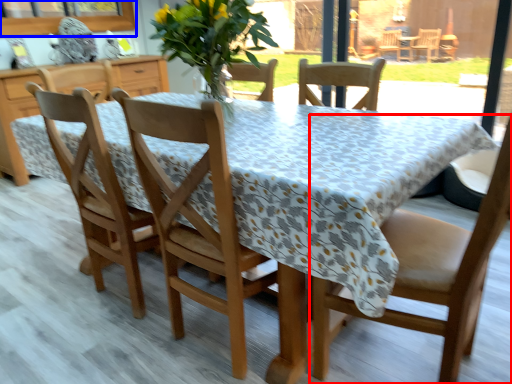
Question: Among these objects, which one is nearest to the camera, chair (highlighted by a red box) or window screen (highlighted by a blue box)?

Choices:
 (A) chair
 (B) window screen

Answer: (A)